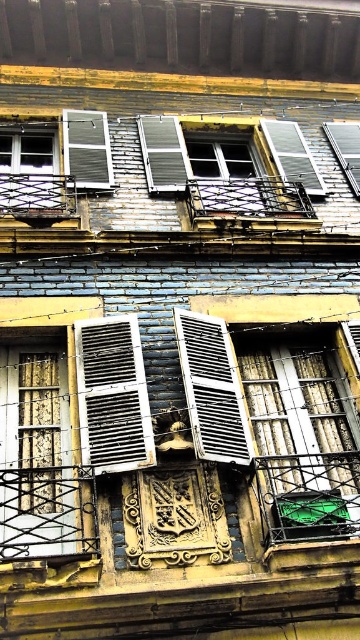
You are an architect examining the building facade. You notice the white matte shutter at center and the transparent glass window at upper right. Based on their positions, which one is situated higher up on the building?

The transparent glass window at upper right is situated higher up on the building because the white matte shutter at center is located below it.